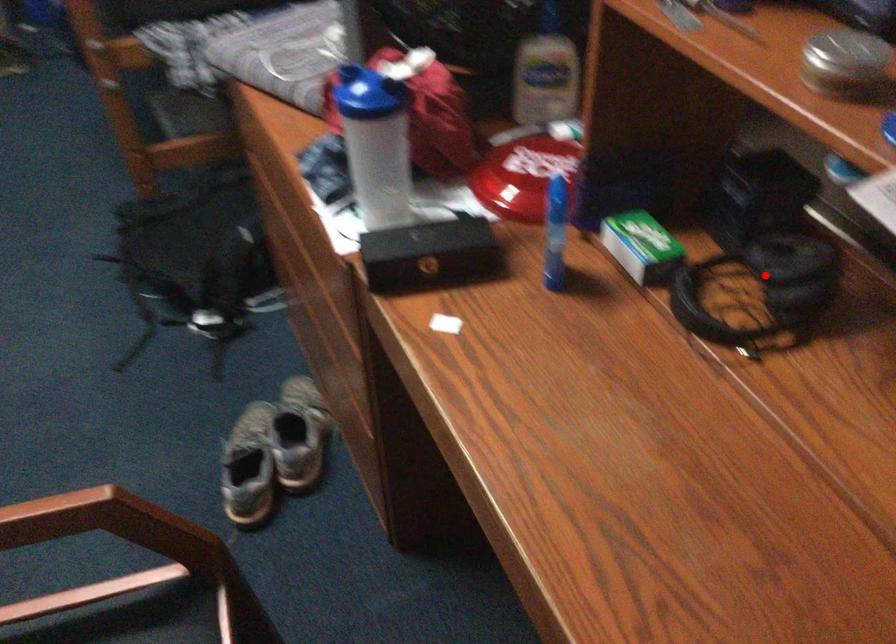
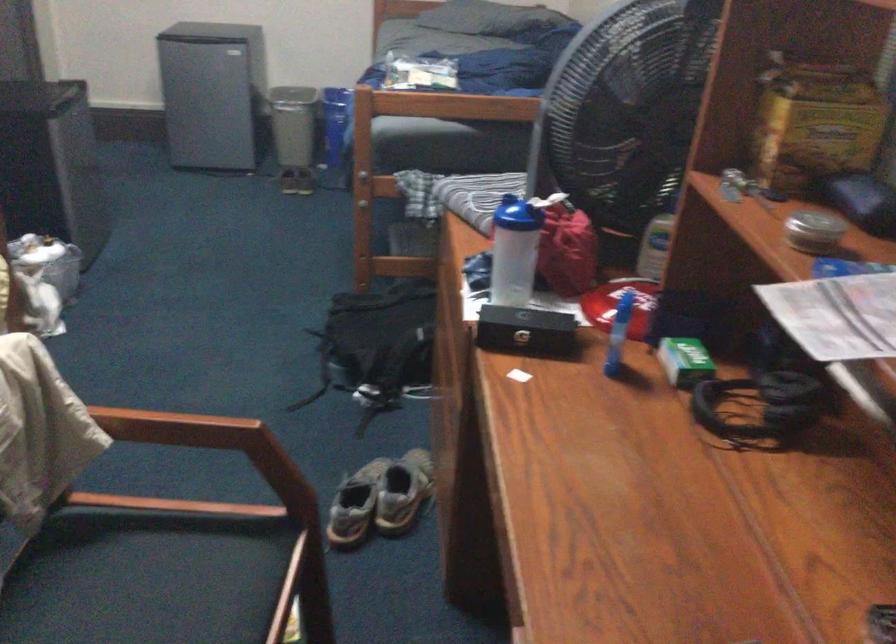
Question: A red point is marked in image1. In image2, is the corresponding 3D point closer to the camera or farther? Reply with the corresponding letter.

Choices:
 (A) The corresponding 3D point is closer.
 (B) The corresponding 3D point is farther.

Answer: (B)